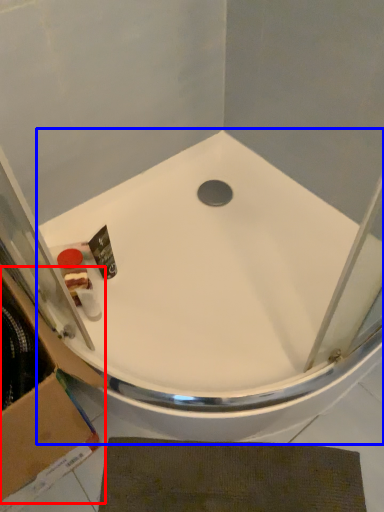
Question: Which of the following is the closest to the observer, cardboard box (highlighted by a red box) or bathtub (highlighted by a blue box)?

Choices:
 (A) cardboard box
 (B) bathtub

Answer: (A)